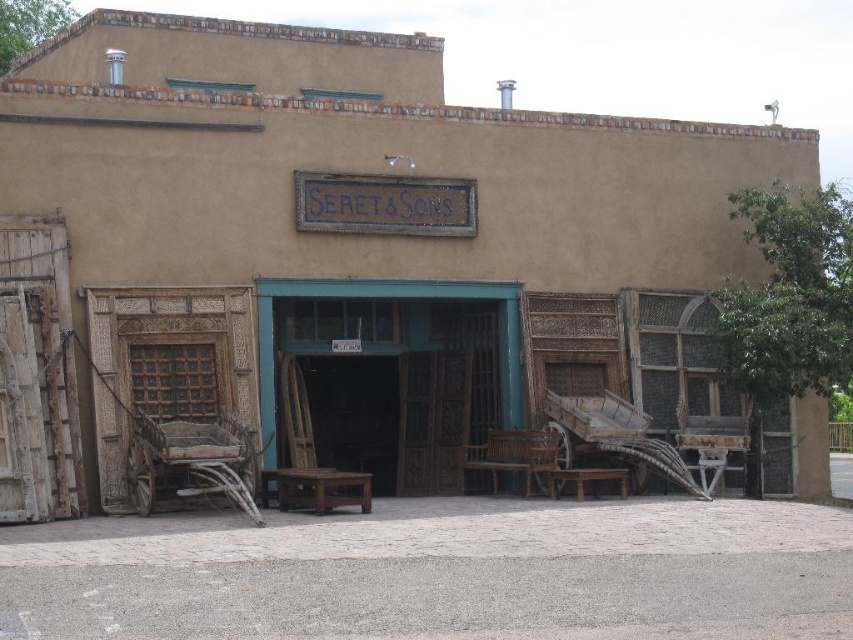
You are standing at the entrance of the building and want to sit down. Where is the wooden bench at center located relative to your position?

The wooden bench at center is located at the coordinates point (389,298) relative to your position at the entrance.